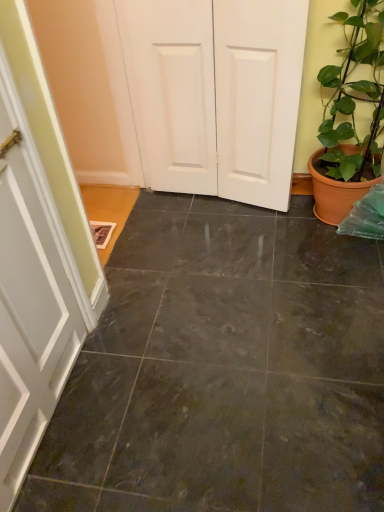
You are a GUI agent. You are given a task and a screenshot of the screen. Output one action in this format:
    pyautogui.click(x=<x>, y=<y>)
    Task: Click on the dark gray tile floor at center
    The width and height of the screenshot is (384, 512).
    Given the screenshot: What is the action you would take?
    pyautogui.click(x=224, y=369)

Is there a large distance between white matte door at center and green glossy plant at right?

No, white matte door at center is in close proximity to green glossy plant at right.

From the image's perspective, does white matte door at center appear higher than green glossy plant at right?

Yes, from the image's perspective, white matte door at center is above green glossy plant at right.

Find the location of a particular element. Image resolution: width=384 pixels, height=512 pixels. houseplant above the white matte door at center (from a real-world perspective) is located at coordinates (350, 116).

In the image, is dark gray tile floor at center on the left side or the right side of white matte door at center?

In the image, dark gray tile floor at center appears on the right side of white matte door at center.

Could you tell me if dark gray tile floor at center is turned towards white matte door at center?

No, dark gray tile floor at center is not aimed at white matte door at center.

Considering the relative sizes of dark gray tile floor at center and white matte door at center in the image provided, is dark gray tile floor at center taller than white matte door at center?

Incorrect, the height of dark gray tile floor at center is not larger of that of white matte door at center.

Is green glossy plant at right positioned beyond the bounds of white matte door at center?

That's correct, green glossy plant at right is outside of white matte door at center.

Does point (379, 90) come behind point (187, 117)?

No.

Which is more to the right, green glossy plant at right or white matte door at center?

green glossy plant at right is more to the right.

Is green glossy plant at right taller than white matte door at center?

Yes, green glossy plant at right is taller than white matte door at center.

Considering the positions of points (187, 492) and (374, 29), is point (187, 492) farther from camera compared to point (374, 29)?

No, (187, 492) is closer to viewer.

Based on the photo, is dark gray tile floor at center smaller than green glossy plant at right?

Correct, dark gray tile floor at center occupies less space than green glossy plant at right.

Does dark gray tile floor at center turn towards green glossy plant at right?

No, dark gray tile floor at center is not oriented towards green glossy plant at right.

Looking at this image, considering the sizes of dark gray tile floor at center and green glossy plant at right in the image, is dark gray tile floor at center wider or thinner than green glossy plant at right?

Considering their sizes, dark gray tile floor at center looks broader than green glossy plant at right.

Is white matte door at center oriented away from dark gray tile floor at center?

No, dark gray tile floor at center is not at the back of white matte door at center.

From the image's perspective, is white matte door at center above dark gray tile floor at center?

Yes, from the image's perspective, white matte door at center is over dark gray tile floor at center.

In the scene shown: From a real-world perspective, is white matte door at center above or below dark gray tile floor at center?

In terms of real-world spatial position, white matte door at center is above dark gray tile floor at center.

Does point (274, 48) appear closer or farther from the camera than point (180, 292)?

Point (274, 48) appears to be closer to the viewer than point (180, 292).

Based on the photo, from the image's perspective, is green glossy plant at right located above dark gray tile floor at center?

Yes, from the image's perspective, green glossy plant at right is on top of dark gray tile floor at center.

Considering the sizes of green glossy plant at right and dark gray tile floor at center in the image, is green glossy plant at right taller or shorter than dark gray tile floor at center?

green glossy plant at right is taller than dark gray tile floor at center.

Is dark gray tile floor at center inside green glossy plant at right?

No.

In terms of size, does green glossy plant at right appear bigger or smaller than dark gray tile floor at center?

Considering their sizes, green glossy plant at right takes up more space than dark gray tile floor at center.

This screenshot has height=512, width=384. In order to click on houseplant below the white matte door at center (from the image's perspective) in this screenshot , I will do `click(350, 116)`.

Where is `door above the dark gray tile floor at center (from a real-world perspective)`? This screenshot has width=384, height=512. door above the dark gray tile floor at center (from a real-world perspective) is located at coordinates (216, 94).

Based on their spatial positions, is white matte door at center or dark gray tile floor at center further from green glossy plant at right?

dark gray tile floor at center.

Estimate the real-world distances between objects in this image. Which object is closer to dark gray tile floor at center, white matte door at center or green glossy plant at right?

green glossy plant at right is positioned closer to the anchor dark gray tile floor at center.

Based on their spatial positions, is dark gray tile floor at center or white matte door at center closer to green glossy plant at right?

The object closer to green glossy plant at right is white matte door at center.

In the scene shown: Which object lies nearer to the anchor point white matte door at center, green glossy plant at right or dark gray tile floor at center?

green glossy plant at right is positioned closer to the anchor white matte door at center.

Consider the image. Which object lies further to the anchor point dark gray tile floor at center, green glossy plant at right or white matte door at center?

white matte door at center.

Based on their spatial positions, is dark gray tile floor at center or green glossy plant at right further from white matte door at center?

dark gray tile floor at center is further to white matte door at center.

This screenshot has width=384, height=512. Find the location of `houseplant between white matte door at center and dark gray tile floor at center vertically`. houseplant between white matte door at center and dark gray tile floor at center vertically is located at coordinates (350, 116).